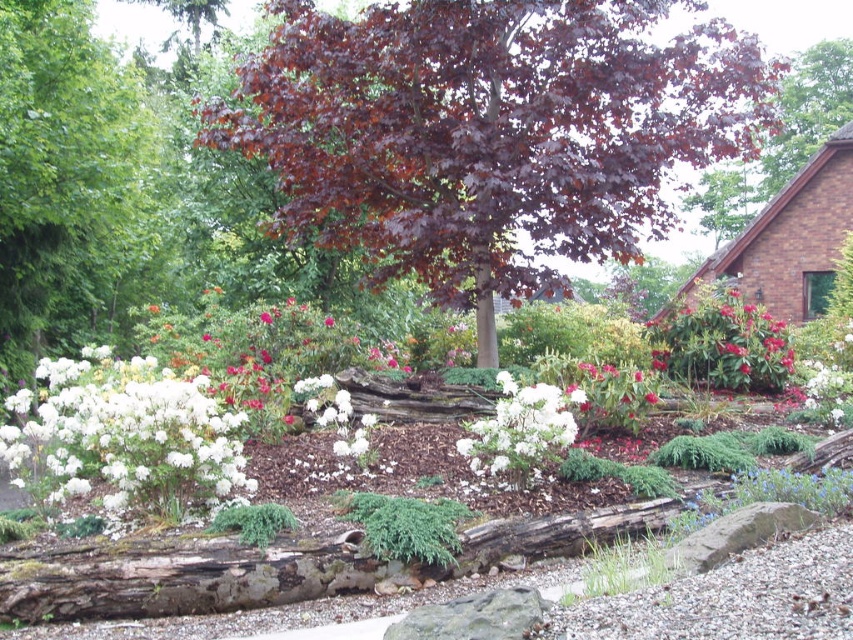
Who is positioned more to the right, green textured bush at center or gray rough rock at lower center?

From the viewer's perspective, gray rough rock at lower center appears more on the right side.

Is point (379, 499) in front of point (527, 627)?

No, it is behind (527, 627).

Between point (438, 513) and point (509, 588), which one is positioned in front?

Point (509, 588) is more forward.

Locate an element on the screen. The height and width of the screenshot is (640, 853). green textured bush at center is located at coordinates (405, 525).

Which of these two, dark purple leafy tree at center or gray rough rock at lower center, stands taller?

Standing taller between the two is dark purple leafy tree at center.

Which is below, dark purple leafy tree at center or gray rough rock at lower center?

gray rough rock at lower center is lower down.

Where is `dark purple leafy tree at center`? The height and width of the screenshot is (640, 853). dark purple leafy tree at center is located at coordinates (488, 132).

Is point (781, 125) in front of point (463, 516)?

No, it is not.

Can you confirm if dark red wood at upper right is positioned to the left of green textured bush at center?

No, dark red wood at upper right is not to the left of green textured bush at center.

Is point (735, 198) less distant than point (468, 516)?

No.

At what (x,y) coordinates should I click in order to perform the action: click on dark red wood at upper right. Please return your answer as a coordinate pair (x, y). Looking at the image, I should click on (779, 140).